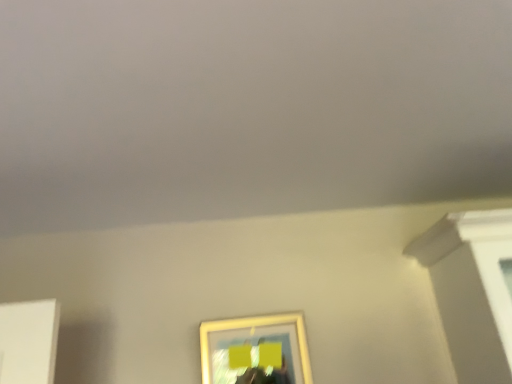
What do you see at coordinates (255, 350) in the screenshot? I see `matte gold picture frame at lower center` at bounding box center [255, 350].

Locate an element on the screen. The width and height of the screenshot is (512, 384). matte gold picture frame at lower center is located at coordinates click(255, 350).

I want to click on matte gold picture frame at lower center, so click(255, 350).